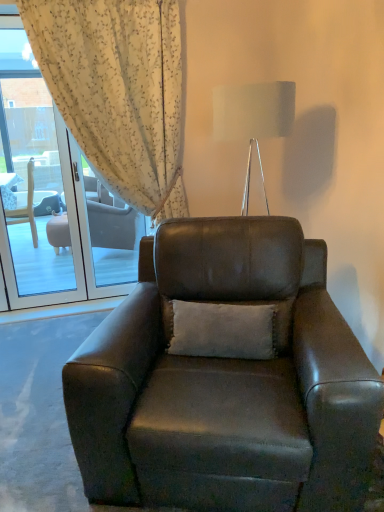
Image resolution: width=384 pixels, height=512 pixels. Describe the element at coordinates (222, 330) in the screenshot. I see `white soft cushion at center` at that location.

At what (x,y) coordinates should I click in order to perform the action: click on metallic silver lamp at upper center. Please return your answer as a coordinate pair (x, y). This screenshot has width=384, height=512. Looking at the image, I should click on (253, 119).

What do you see at coordinates (119, 90) in the screenshot? I see `white floral fabric at upper left` at bounding box center [119, 90].

The image size is (384, 512). I want to click on white soft cushion at center, so click(x=222, y=330).

Between point (188, 377) and point (110, 110), which one is positioned behind?

The point (110, 110) is farther.

Is leather armchair at center taller or shorter than white floral fabric at upper left?

Considering their sizes, leather armchair at center has less height than white floral fabric at upper left.

Is leather armchair at center wider than white floral fabric at upper left?

Yes.

Considering the positions of point (176, 330) and point (280, 341), is point (176, 330) closer or farther from the camera than point (280, 341)?

Point (176, 330) is closer to the camera than point (280, 341).

Which of these two, white soft cushion at center or leather armchair at center, stands shorter?

white soft cushion at center is shorter.

Based on the photo, does white soft cushion at center lie in front of leather armchair at center?

That is False.

Is white soft cushion at center not within leather armchair at center?

Actually, white soft cushion at center is within leather armchair at center.

Considering the relative sizes of white floral fabric at upper left and metallic silver lamp at upper center in the image provided, is white floral fabric at upper left wider than metallic silver lamp at upper center?

Incorrect, the width of white floral fabric at upper left does not surpass that of metallic silver lamp at upper center.

Is metallic silver lamp at upper center a part of white floral fabric at upper left?

Actually, metallic silver lamp at upper center is outside white floral fabric at upper left.

How different are the orientations of white floral fabric at upper left and metallic silver lamp at upper center in degrees?

white floral fabric at upper left and metallic silver lamp at upper center are facing 38.1 degrees away from each other.

Identify the location of curtain to the left of metallic silver lamp at upper center. The width and height of the screenshot is (384, 512). (119, 90).

Consider the image. Is metallic silver lamp at upper center surrounding white floral fabric at upper left?

Definitely not — white floral fabric at upper left is not inside metallic silver lamp at upper center.

How many degrees apart are the facing directions of metallic silver lamp at upper center and white floral fabric at upper left?

The angle between the facing direction of metallic silver lamp at upper center and the facing direction of white floral fabric at upper left is 38.1 degrees.

Is white floral fabric at upper left at the back of metallic silver lamp at upper center?

metallic silver lamp at upper center is not turned away from white floral fabric at upper left.

Is metallic silver lamp at upper center facing towards white soft cushion at center?

No, metallic silver lamp at upper center is not aimed at white soft cushion at center.

Which is more to the right, metallic silver lamp at upper center or white soft cushion at center?

Positioned to the right is metallic silver lamp at upper center.

In terms of width, does metallic silver lamp at upper center look wider or thinner when compared to white soft cushion at center?

Considering their sizes, metallic silver lamp at upper center looks broader than white soft cushion at center.

Considering the positions of point (283, 123) and point (253, 356), is point (283, 123) closer or farther from the camera than point (253, 356)?

Point (283, 123) is positioned farther from the camera compared to point (253, 356).

Can you confirm if white floral fabric at upper left is taller than leather armchair at center?

Yes.

From the image's perspective, between white floral fabric at upper left and leather armchair at center, which one is located above?

white floral fabric at upper left, from the image's perspective.

Considering the relative positions of white floral fabric at upper left and leather armchair at center in the image provided, is white floral fabric at upper left to the left of leather armchair at center from the viewer's perspective?

Correct, you'll find white floral fabric at upper left to the left of leather armchair at center.

Can you confirm if white floral fabric at upper left is smaller than leather armchair at center?

Indeed, white floral fabric at upper left has a smaller size compared to leather armchair at center.

Can you tell me how much metallic silver lamp at upper center and leather armchair at center differ in facing direction?

They differ by 13.7 degrees in their facing directions.

Does metallic silver lamp at upper center have a smaller size compared to leather armchair at center?

Correct, metallic silver lamp at upper center occupies less space than leather armchair at center.

Can you confirm if metallic silver lamp at upper center is taller than leather armchair at center?

No, metallic silver lamp at upper center is not taller than leather armchair at center.

Looking at their sizes, would you say metallic silver lamp at upper center is wider or thinner than leather armchair at center?

Considering their sizes, metallic silver lamp at upper center looks slimmer than leather armchair at center.

Find the location of a particular element. curtain above the leather armchair at center (from the image's perspective) is located at coordinates (119, 90).

Where is `chair in front of the white soft cushion at center`? chair in front of the white soft cushion at center is located at coordinates (226, 383).

Considering their positions, is leather armchair at center positioned further to metallic silver lamp at upper center than white floral fabric at upper left?

The object further to metallic silver lamp at upper center is leather armchair at center.

Estimate the real-world distances between objects in this image. Which object is closer to metallic silver lamp at upper center, leather armchair at center or white soft cushion at center?

Among the two, white soft cushion at center is located nearer to metallic silver lamp at upper center.

Looking at the image, which one is located further to leather armchair at center, white soft cushion at center or metallic silver lamp at upper center?

metallic silver lamp at upper center is positioned further to the anchor leather armchair at center.

From the image, which object appears to be nearer to leather armchair at center, white floral fabric at upper left or metallic silver lamp at upper center?

Among the two, metallic silver lamp at upper center is located nearer to leather armchair at center.

Based on their spatial positions, is metallic silver lamp at upper center or white soft cushion at center closer to white floral fabric at upper left?

metallic silver lamp at upper center is positioned closer to the anchor white floral fabric at upper left.

Looking at the image, which one is located closer to white floral fabric at upper left, metallic silver lamp at upper center or leather armchair at center?

Based on the image, metallic silver lamp at upper center appears to be nearer to white floral fabric at upper left.

When comparing their distances from white floral fabric at upper left, does white soft cushion at center or leather armchair at center seem further?

Based on the image, white soft cushion at center appears to be further to white floral fabric at upper left.

Estimate the real-world distances between objects in this image. Which object is further from leather armchair at center, white floral fabric at upper left or white soft cushion at center?

white floral fabric at upper left.

I want to click on pillow between metallic silver lamp at upper center and leather armchair at center vertically, so click(222, 330).

What are the coordinates of `lamp between white floral fabric at upper left and white soft cushion at center from top to bottom` in the screenshot? It's located at (253, 119).

You are a GUI agent. You are given a task and a screenshot of the screen. Output one action in this format:
    pyautogui.click(x=<x>, y=<y>)
    Task: Click on the lamp positioned between leather armchair at center and white floral fabric at upper left from near to far
    
    Given the screenshot: What is the action you would take?
    pyautogui.click(x=253, y=119)

Where is `pillow located between leather armchair at center and white floral fabric at upper left in the depth direction`? The height and width of the screenshot is (512, 384). pillow located between leather armchair at center and white floral fabric at upper left in the depth direction is located at coordinates (222, 330).